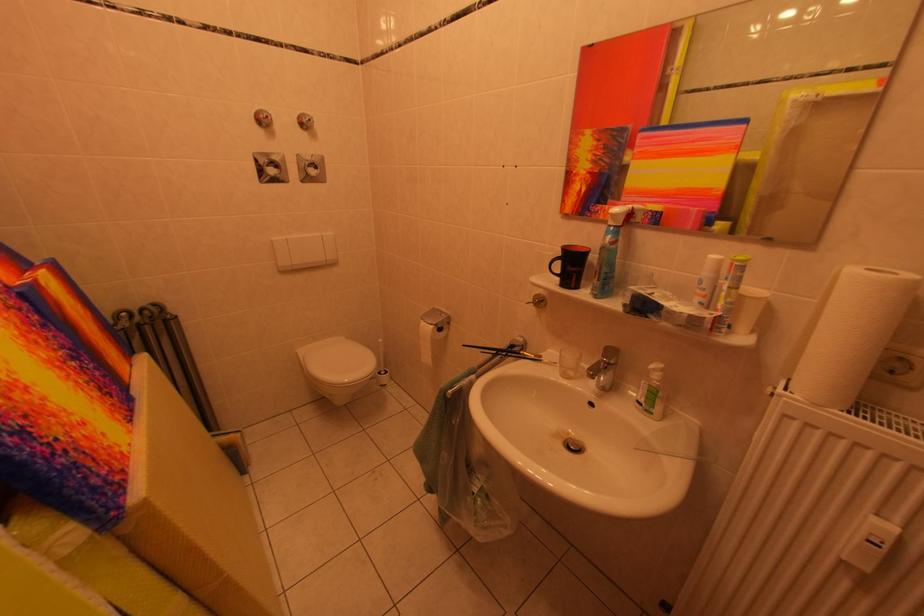
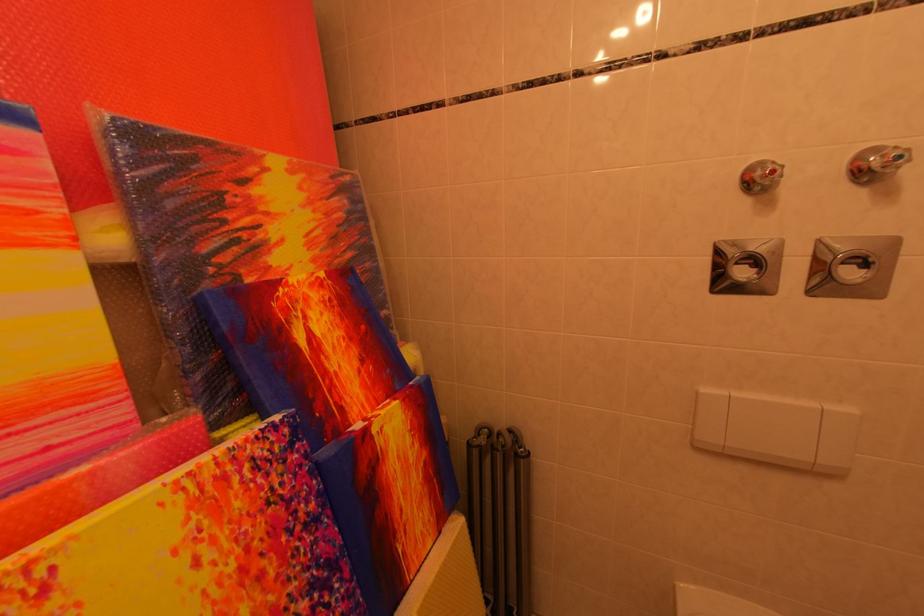
Find the pixel in the second image that matches (x=276, y=120) in the first image.

(782, 176)